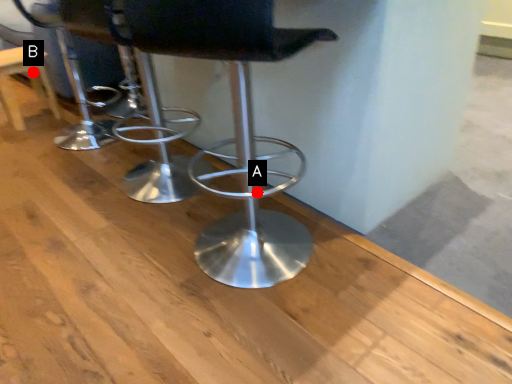
Question: Two points are circled on the image, labeled by A and B beside each circle. Which point is farther to the camera?

Choices:
 (A) A is further
 (B) B is further

Answer: (B)